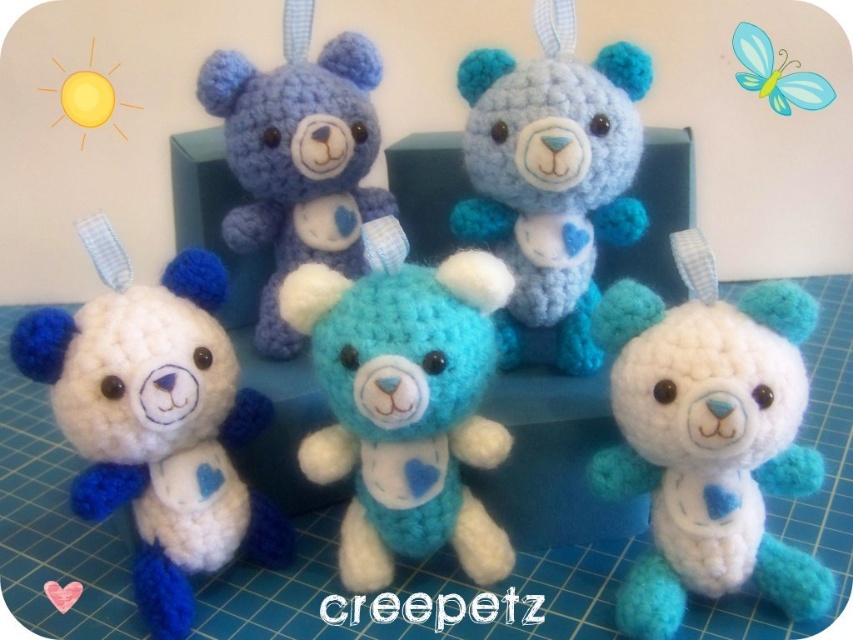
Does teal yarn teddy bear at center have a smaller size compared to blue yarn teddy bear at upper center?

Yes.

Who is more forward, (532,140) or (254,180)?

Point (532,140) is in front.

What do you see at coordinates (550, 177) in the screenshot? The width and height of the screenshot is (853, 640). I see `teal yarn teddy bear at center` at bounding box center [550, 177].

The image size is (853, 640). In order to click on teal yarn teddy bear at center in this screenshot , I will do `click(550, 177)`.

From the picture: Which is above, white yarn teddy bear at center or turquoise yarn teddy bear at center?

turquoise yarn teddy bear at center

Looking at this image, between white yarn teddy bear at center and turquoise yarn teddy bear at center, which one has less height?

With less height is turquoise yarn teddy bear at center.

Does point (674, 314) come in front of point (387, 525)?

Yes.

In order to click on white yarn teddy bear at center in this screenshot , I will do (x=708, y=440).

Does white yarn teddy bear at center have a greater width compared to white yarn teddy bear at lower left?

No, white yarn teddy bear at center is not wider than white yarn teddy bear at lower left.

Which is above, white yarn teddy bear at center or white yarn teddy bear at lower left?

white yarn teddy bear at center is above.

Between point (703, 308) and point (206, 435), which one is positioned in front?

Point (703, 308)

I want to click on white yarn teddy bear at center, so click(708, 440).